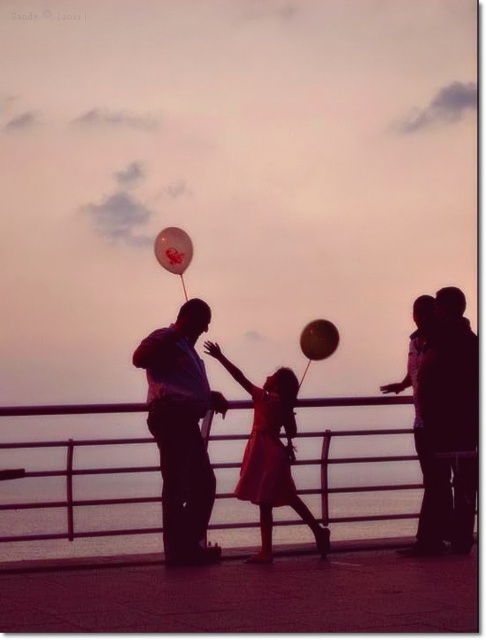
Looking at this image, you are standing at the pier and want to take a photo. There are two points of interest marked in the scene. The first is at point coordinate point (x=435, y=353) and the second is at point coordinate point (x=80, y=506). Which point is closer to your camera?

Point (x=435, y=353) is further to the camera than point (x=80, y=506), so the point closer to your camera is point (x=80, y=506).

You are standing at the pier and notice two dresses hanging on the railing. The matte black dress at center and the matte red dress at center. Which dress is closer to you?

The matte black dress at center is closer to you since it is in front of the matte red dress at center.